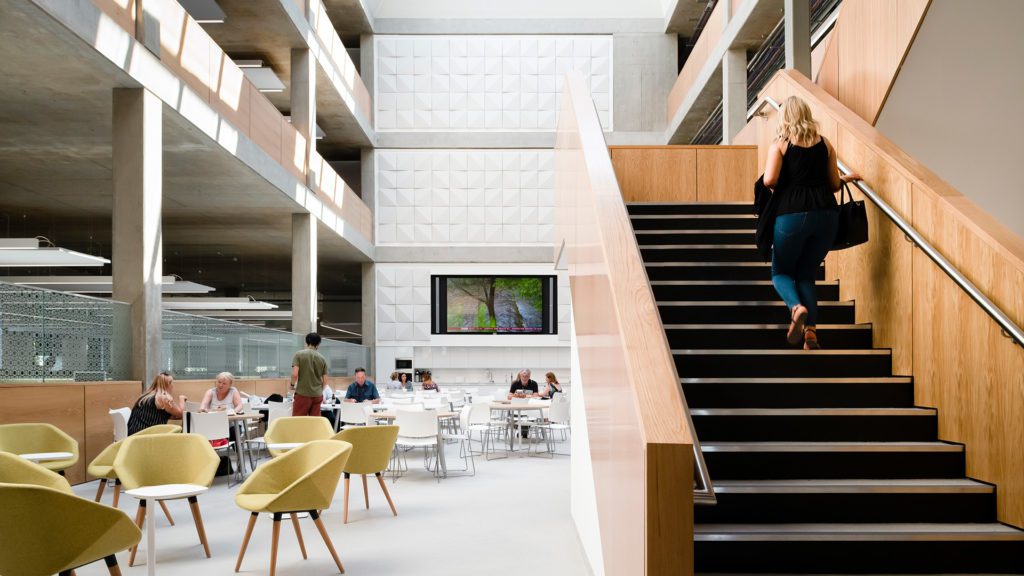
Locate an element on the screen. Image resolution: width=1024 pixels, height=576 pixels. number of pillars is located at coordinates (307, 104), (301, 250), (147, 200), (739, 86), (797, 48).